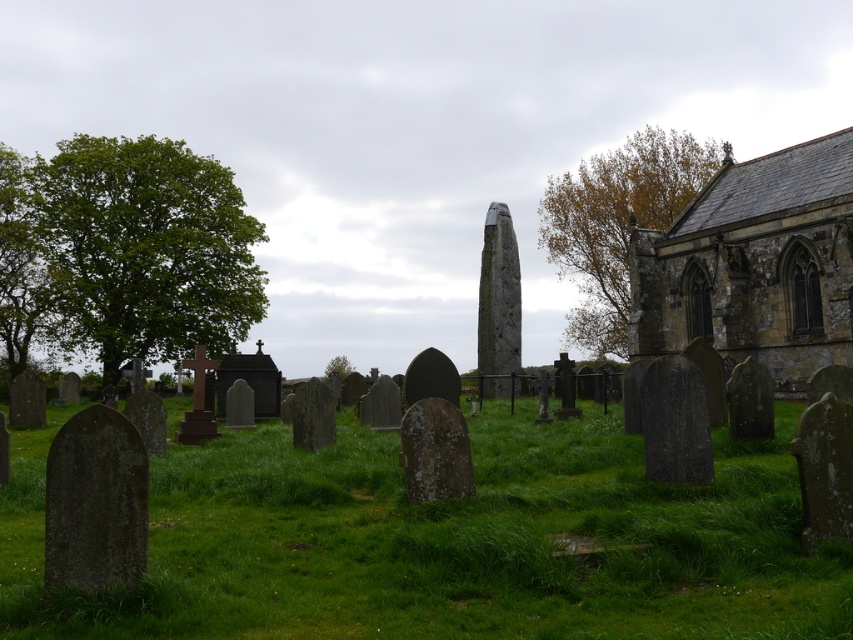
Is point (155, 202) farther from camera compared to point (339, 372)?

No, (155, 202) is closer to viewer.

At what (x,y) coordinates should I click in order to perform the action: click on green leafy tree at left. Please return your answer as a coordinate pair (x, y). Looking at the image, I should click on (143, 250).

The width and height of the screenshot is (853, 640). What do you see at coordinates (143, 250) in the screenshot?
I see `green leafy tree at left` at bounding box center [143, 250].

Find the location of a particular element. green leafy tree at left is located at coordinates (143, 250).

Does green grassy at center appear on the left side of brown stone church at upper right?

Indeed, green grassy at center is positioned on the left side of brown stone church at upper right.

Can you confirm if green grassy at center is shorter than brown stone church at upper right?

Correct, green grassy at center is not as tall as brown stone church at upper right.

Locate an element on the screen. The width and height of the screenshot is (853, 640). green grassy at center is located at coordinates (444, 540).

This screenshot has height=640, width=853. I want to click on green grassy at center, so click(x=444, y=540).

Can you confirm if green leafy tree at left is thinner than brown stone church at upper right?

No, green leafy tree at left is not thinner than brown stone church at upper right.

Is point (189, 308) closer to viewer compared to point (827, 180)?

No, it is not.

Locate an element on the screen. green leafy tree at left is located at coordinates coord(143,250).

The width and height of the screenshot is (853, 640). Identify the location of green leafy tree at left. (143, 250).